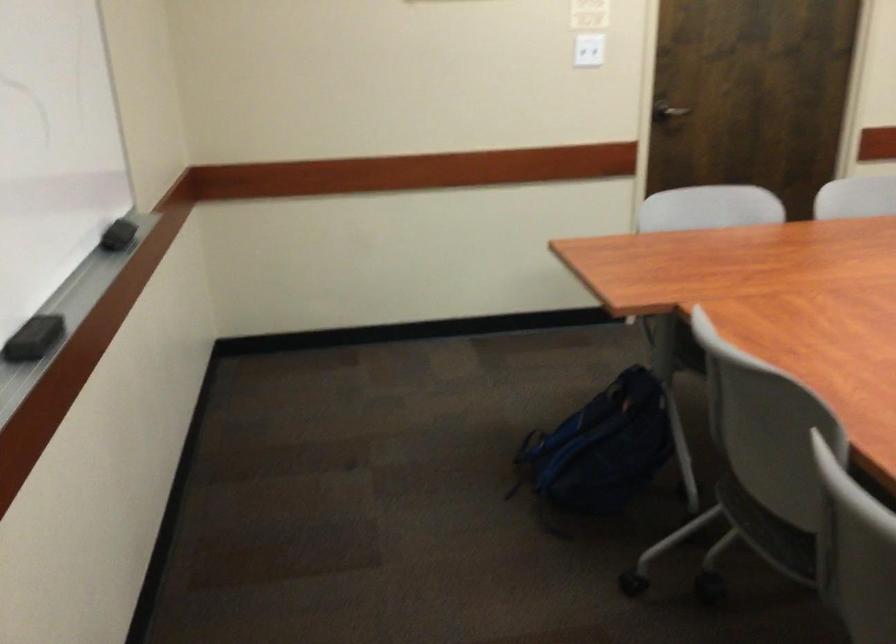
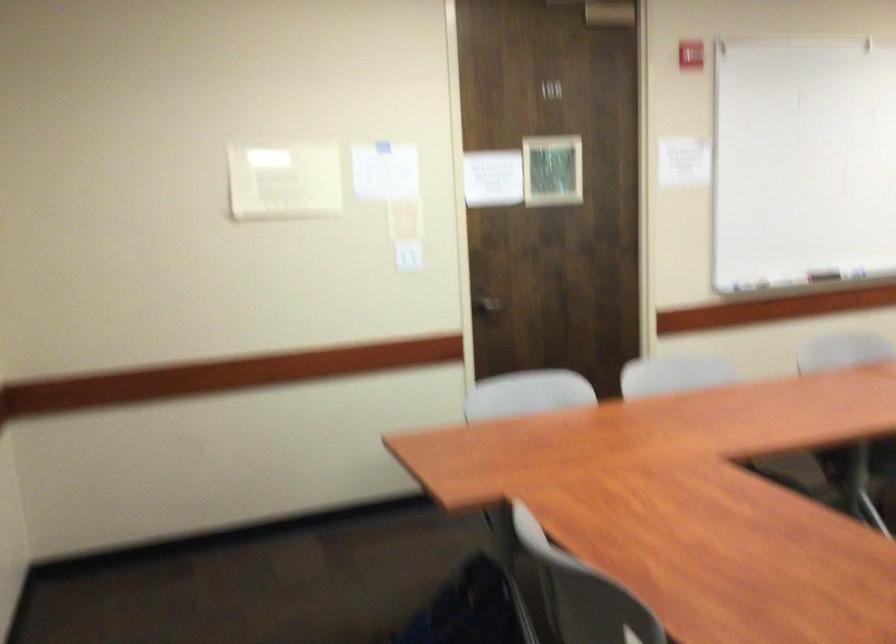
Question: The first image is from the beginning of the video and the second image is from the end. How did the camera likely rotate when shooting the video?

Choices:
 (A) Left
 (B) Right
 (C) Up
 (D) Down

Answer: (C)